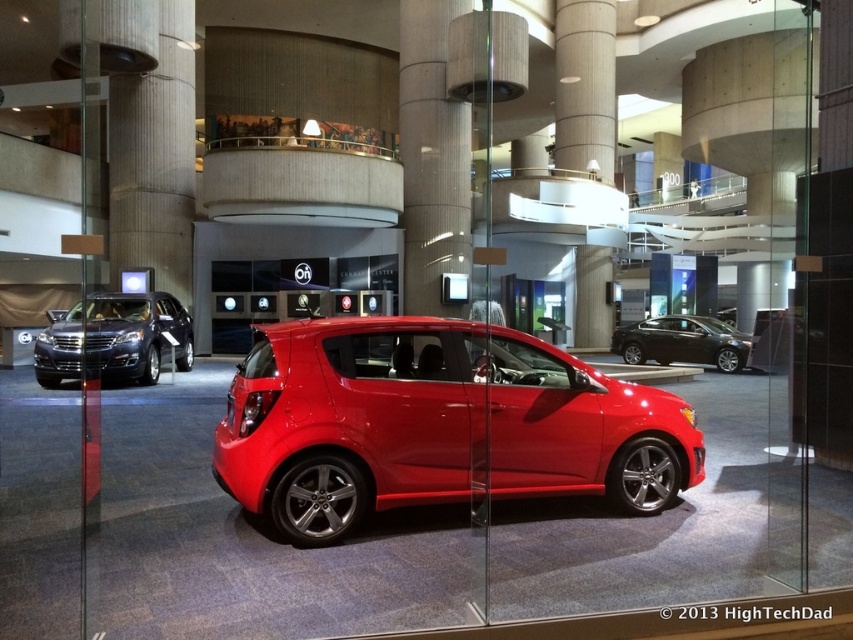
You are a photographer setting up a shoot in the car showroom. You need to determine which vehicle is shorter between the shiny black suv at left and the glossy black sedan at center. Based on the scene, which one should you focus on first if you want to capture the shorter vehicle?

The shiny black suv at left is not as tall as the glossy black sedan at center, so you should focus on the shiny black suv at left first to capture the shorter vehicle.

You are a photographer setting up a shoot in the car showroom. You want to capture both the glossy red hatchback at center and the glossy black sedan at center in the same frame. Based on their positions, which car should you focus on first to ensure both are in the shot?

The glossy red hatchback at center is in front of the glossy black sedan at center, so you should focus on the glossy black sedan at center first to ensure both are in the shot.

You are standing in the car showroom and see two points marked on the floor. The first point is at coordinate point(457, 422) and the second is at point(697, 326). Which point is closer to you?

Point(457, 422) is in front of point(697, 326), so it is closer to you.